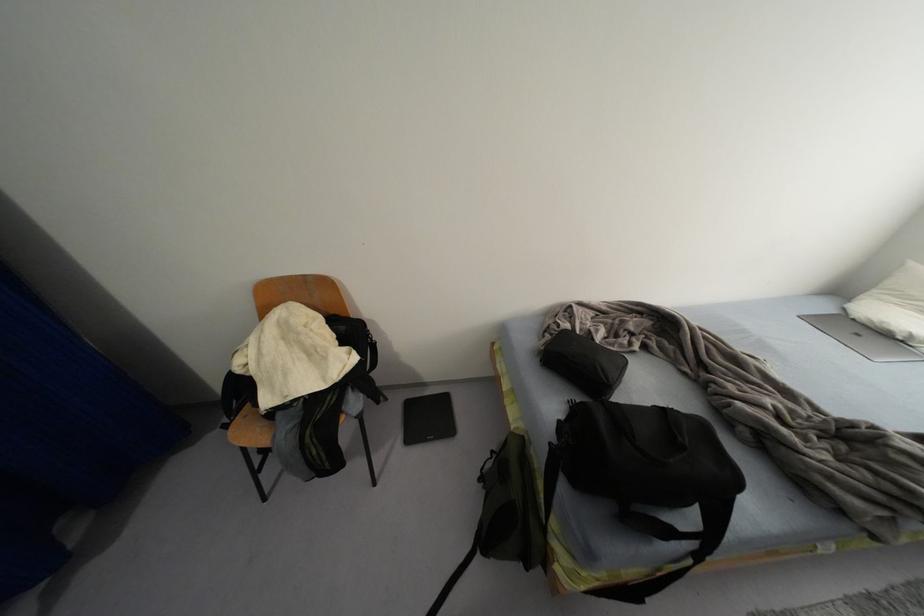
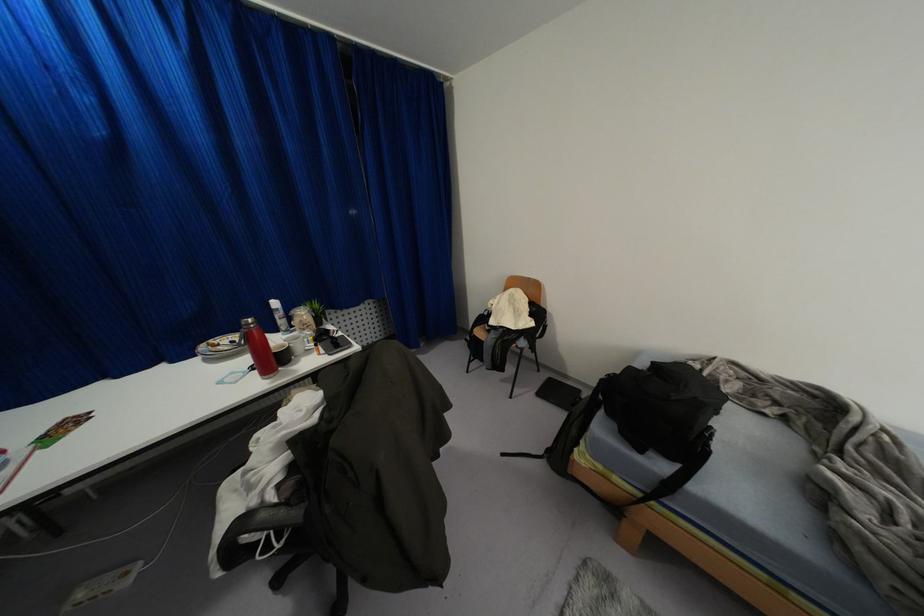
Question: The first image is from the beginning of the video and the second image is from the end. How did the camera likely rotate when shooting the video?

Choices:
 (A) Left
 (B) Right
 (C) Up
 (D) Down

Answer: (A)